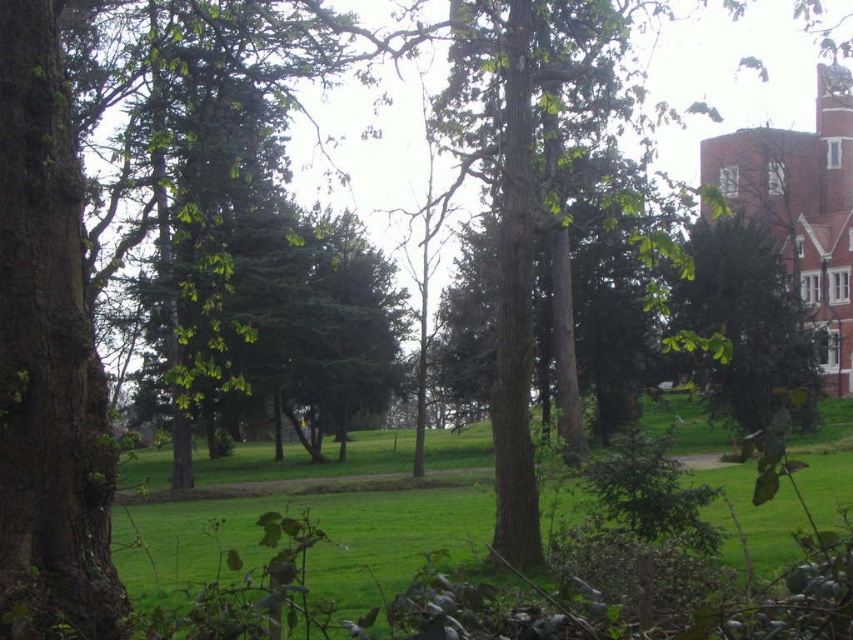
Question: Does green grassy at center come in front of green leafy tree at right?

Choices:
 (A) yes
 (B) no

Answer: (B)

Question: Which object is farther from the camera taking this photo?

Choices:
 (A) green leafy tree at right
 (B) green grassy at center

Answer: (B)

Question: Can you confirm if green grassy at center is positioned below green leafy tree at right?

Choices:
 (A) no
 (B) yes

Answer: (B)

Question: Observing the image, what is the correct spatial positioning of green grassy at center in reference to green leafy tree at right?

Choices:
 (A) below
 (B) above

Answer: (A)

Question: Which object appears closest to the camera in this image?

Choices:
 (A) green leafy tree at right
 (B) green grassy at center

Answer: (A)